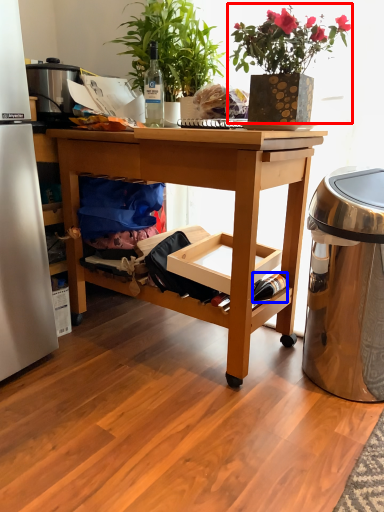
Question: Which of the following is the closest to the observer, houseplant (highlighted by a red box) or bottle (highlighted by a blue box)?

Choices:
 (A) houseplant
 (B) bottle

Answer: (A)